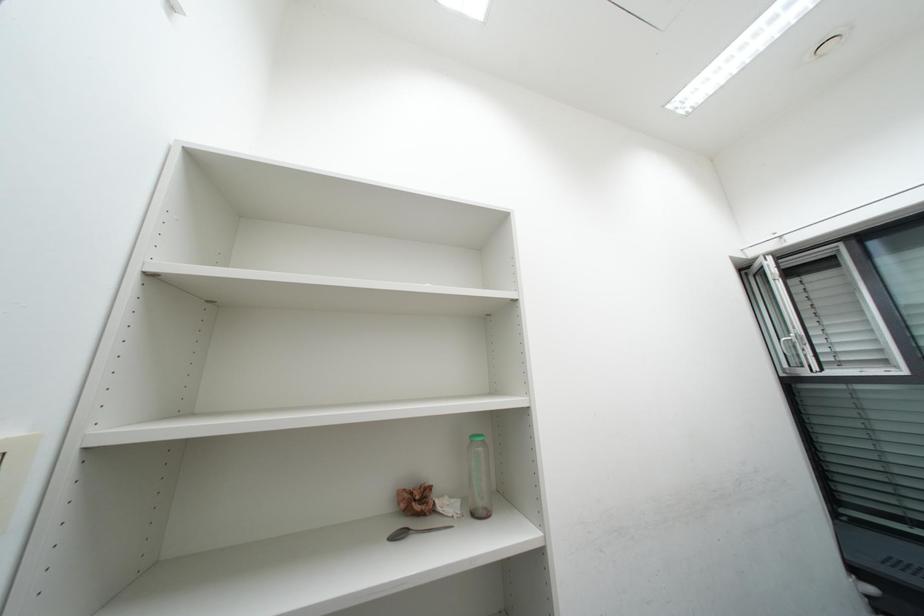
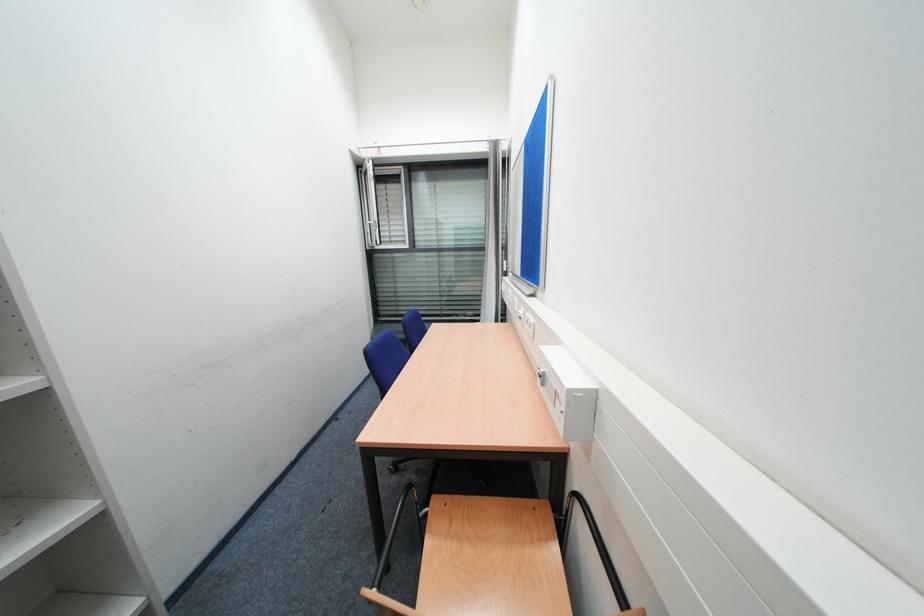
Based on the continuous images, in which direction is the camera rotating?

The camera rotated toward right-down.